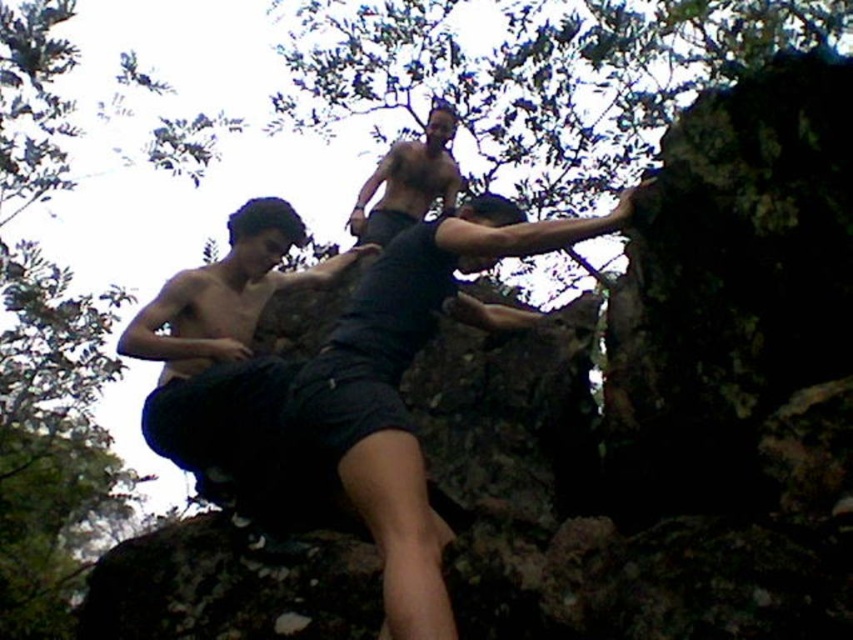
You are a drone operator trying to locate a specific point on the climber in the center. The point you need to find is at coordinates point (399,381). Based on the scene description, where would this point be located on the climber?

The point (399,381) is located on the dark gray shorts at center.

You are a photographer positioned at the base of the rock face. You want to take a photo of both climbers wearing dark gray shorts at center and dark matte shorts at left. Which climber should you focus on first to ensure they are in sharp focus?

You should focus on the dark gray shorts at center first because it is closer to the viewer and will be in focus before the dark matte shorts at left, which is further away.

You are a drone operator tasked with capturing aerial footage of the rock climbing scene. The drone is currently at point A, which is above the dark gray shorts at center. To ensure safety and avoid interference, you need to move the drone to a position that is 0.3 units to the right and 0.2 units downward from its current position. What will be the new coordinates of the drone after this adjustment?

The dark gray shorts at center is at point (399,381). Moving 0.3 units to the right increases the x coordinate to 0.598 0.3 0.898. Moving 0.2 units downward decreases the y coordinate to 0.469 0.2 0.269. The new coordinates will be approximately (229,573).